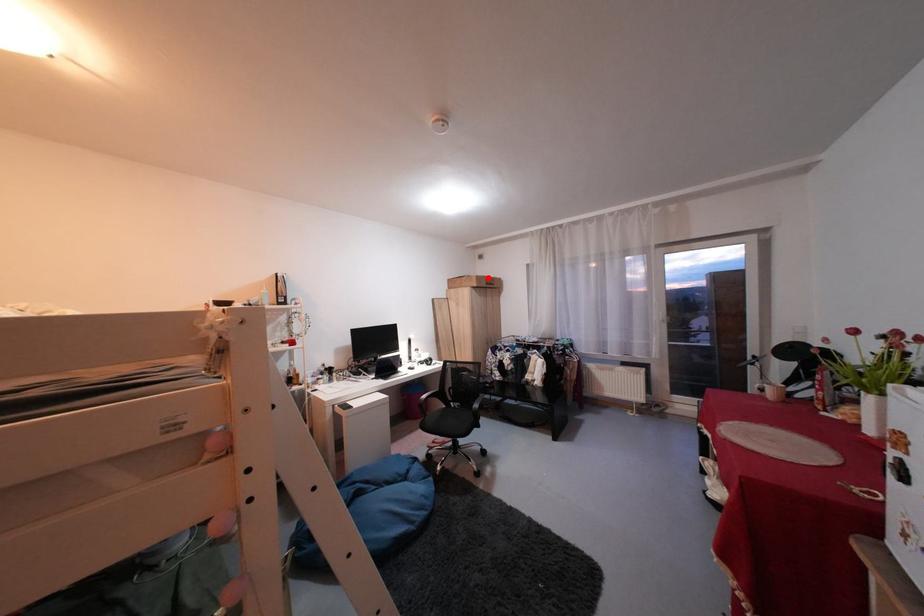
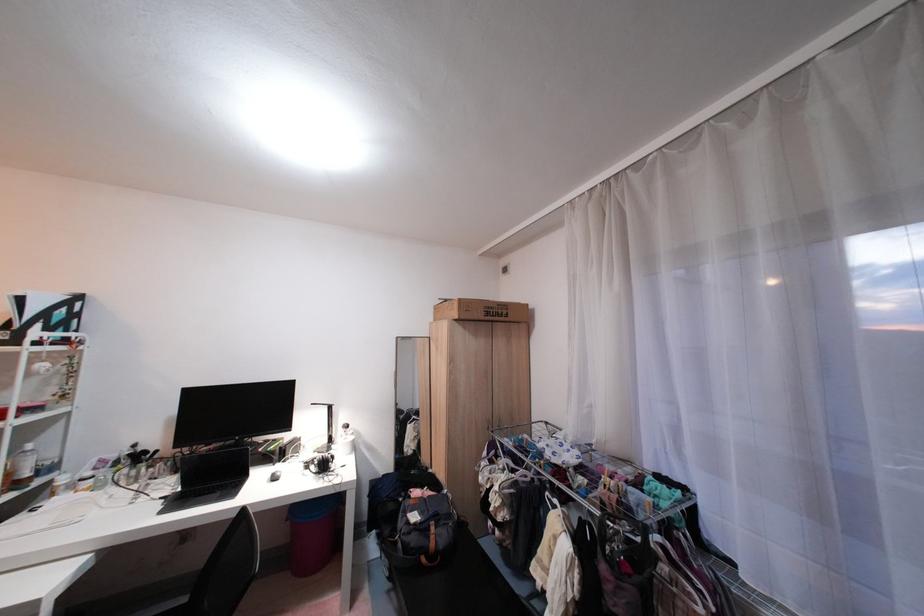
In the second image, find the point that corresponds to the highlighted location in the first image.

(470, 302)